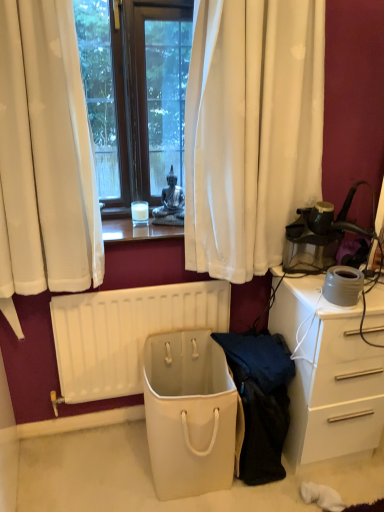
This screenshot has width=384, height=512. What do you see at coordinates (125, 333) in the screenshot?
I see `white matte radiator at lower center` at bounding box center [125, 333].

At what (x,y) coordinates should I click in order to perform the action: click on dark blue fabric at center. Please return your answer as a coordinate pair (x, y). Looking at the image, I should click on (260, 405).

What do you see at coordinates (189, 413) in the screenshot? Image resolution: width=384 pixels, height=512 pixels. I see `beige fabric bag at center` at bounding box center [189, 413].

This screenshot has height=512, width=384. What are the coordinates of `white glossy desk at right` in the screenshot? It's located at (335, 389).

Considering the sizes of metallic statue at center and white glossy desk at right in the image, is metallic statue at center wider or thinner than white glossy desk at right?

metallic statue at center is thinner than white glossy desk at right.

Is metallic statue at center taller than white glossy desk at right?

No, metallic statue at center is not taller than white glossy desk at right.

At what (x,y) coordinates should I click in order to perform the action: click on desk that appears on the right of beige fabric bag at center. Please return your answer as a coordinate pair (x, y). Looking at the image, I should click on (335, 389).

Between beige fabric bag at center and white glossy desk at right, which one has larger size?

Bigger between the two is white glossy desk at right.

Does beige fabric bag at center appear on the left side of white glossy desk at right?

Yes, beige fabric bag at center is to the left of white glossy desk at right.

Who is shorter, white matte radiator at lower center or metallic statue at center?

With less height is metallic statue at center.

Does point (176, 290) come in front of point (174, 207)?

That is True.

In the image, there is a metallic statue at center. Identify the location of radiator below it (from the image's perspective). This screenshot has height=512, width=384. (125, 333).

Looking at their sizes, would you say beige fabric bag at center is wider or thinner than metallic statue at center?

Considering their sizes, beige fabric bag at center looks broader than metallic statue at center.

Measure the distance from beige fabric bag at center to metallic statue at center.

beige fabric bag at center and metallic statue at center are 30.58 inches apart from each other.

Where is `person located behind the beige fabric bag at center`? person located behind the beige fabric bag at center is located at coordinates (170, 197).

In the scene shown: Does beige fabric bag at center appear on the left side of metallic statue at center?

No, beige fabric bag at center is not to the left of metallic statue at center.

Which is in front, point (159, 467) or point (141, 357)?

The point (159, 467) is in front.

Between beige fabric bag at center and white matte radiator at lower center, which one has smaller width?

With smaller width is white matte radiator at lower center.

Who is taller, beige fabric bag at center or white matte radiator at lower center?

With more height is white matte radiator at lower center.

Who is bigger, metallic statue at center or white matte radiator at lower center?

white matte radiator at lower center.

Is white matte radiator at lower center at the back of metallic statue at center?

metallic statue at center does not have its back to white matte radiator at lower center.

Does metallic statue at center have a greater width compared to white matte radiator at lower center?

Yes, metallic statue at center is wider than white matte radiator at lower center.

In the image, is metallic statue at center on the left side or the right side of white matte radiator at lower center?

From the image, it's evident that metallic statue at center is to the right of white matte radiator at lower center.

Can you see metallic statue at center touching beige fabric bag at center?

No, metallic statue at center is not with beige fabric bag at center.

Is metallic statue at center wider than beige fabric bag at center?

No, metallic statue at center is not wider than beige fabric bag at center.

Is metallic statue at center turned away from beige fabric bag at center?

metallic statue at center does not have its back to beige fabric bag at center.

Is point (167, 180) positioned before point (161, 383)?

Yes, point (167, 180) is closer to viewer.

The width and height of the screenshot is (384, 512). What are the coordinates of `person located behind the white glossy desk at right` in the screenshot? It's located at (170, 197).

In order to click on trash bin/can located underneath the white glossy desk at right (from a real-world perspective) in this screenshot , I will do `click(189, 413)`.

From the picture: From the image, which object appears to be farther from white matte radiator at lower center, beige fabric bag at center or white glossy desk at right?

white glossy desk at right is positioned further to the anchor white matte radiator at lower center.

When comparing their distances from metallic statue at center, does dark blue fabric at center or white matte radiator at lower center seem further?

Based on the image, dark blue fabric at center appears to be further to metallic statue at center.

When comparing their distances from beige fabric bag at center, does white matte radiator at lower center or metallic statue at center seem further?

The object further to beige fabric bag at center is metallic statue at center.

Based on their spatial positions, is white matte radiator at lower center or dark blue fabric at center closer to white glossy desk at right?

dark blue fabric at center is closer to white glossy desk at right.

When comparing their distances from beige fabric bag at center, does white glossy desk at right or metallic statue at center seem closer?

white glossy desk at right lies closer to beige fabric bag at center than the other object.

Considering their positions, is white glossy desk at right positioned further to metallic statue at center than dark blue fabric at center?

Among the two, white glossy desk at right is located further to metallic statue at center.

Estimate the real-world distances between objects in this image. Which object is further from dark blue fabric at center, metallic statue at center or beige fabric bag at center?

Among the two, metallic statue at center is located further to dark blue fabric at center.

Estimate the real-world distances between objects in this image. Which object is further from dark blue fabric at center, white matte radiator at lower center or white glossy desk at right?

Among the two, white matte radiator at lower center is located further to dark blue fabric at center.

Find the location of `trash bin/can between white matte radiator at lower center and dark blue fabric at center from left to right`. trash bin/can between white matte radiator at lower center and dark blue fabric at center from left to right is located at coordinates (189, 413).

At what (x,y) coordinates should I click in order to perform the action: click on trash bin/can located between white matte radiator at lower center and white glossy desk at right in the left-right direction. Please return your answer as a coordinate pair (x, y). The image size is (384, 512). Looking at the image, I should click on (189, 413).

What are the coordinates of `desk between metallic statue at center and dark blue fabric at center vertically` in the screenshot? It's located at (335, 389).

The image size is (384, 512). I want to click on clothing between metallic statue at center and beige fabric bag at center vertically, so click(x=260, y=405).